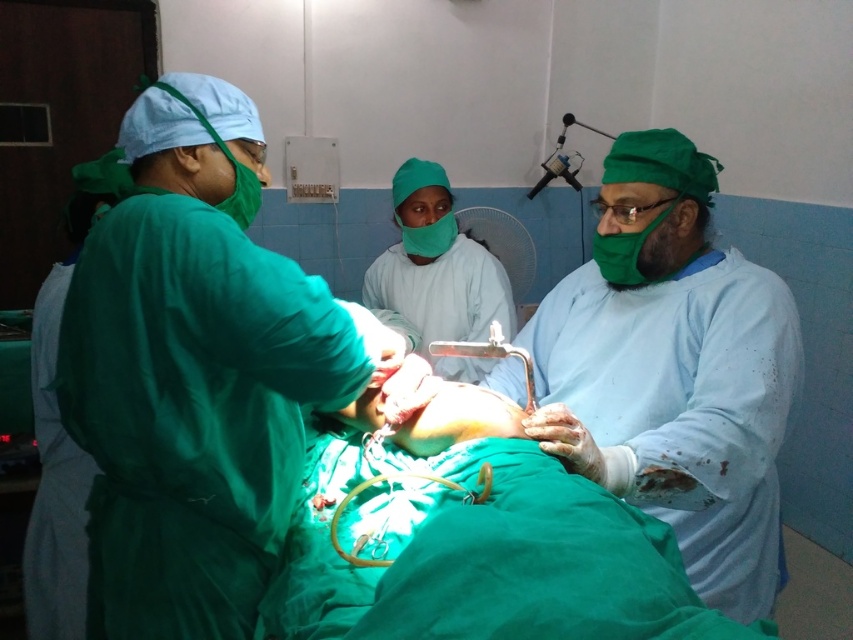
Question: Which of the following is the farthest from the observer?

Choices:
 (A) blue surgical gown at center
 (B) green surgical gown at center
 (C) green matte surgical gown at left
 (D) metallic silver scissors at center

Answer: (A)

Question: Is green matte surgical gown at left positioned before green surgical gown at center?

Choices:
 (A) no
 (B) yes

Answer: (A)

Question: Among these objects, which one is farthest from the camera?

Choices:
 (A) metallic surgical light at center
 (B) metallic silver scissors at center
 (C) green matte surgical gown at left
 (D) green matte surgical gown at center

Answer: (D)

Question: Does metallic silver scissors at center appear under metallic surgical light at center?

Choices:
 (A) no
 (B) yes

Answer: (B)

Question: Observing the image, what is the correct spatial positioning of blue surgical gown at center in reference to metallic silver scissors at center?

Choices:
 (A) left
 (B) right

Answer: (B)

Question: Among these objects, which one is farthest from the camera?

Choices:
 (A) metallic silver scissors at center
 (B) green matte surgical gown at left
 (C) green surgical gown at center

Answer: (A)